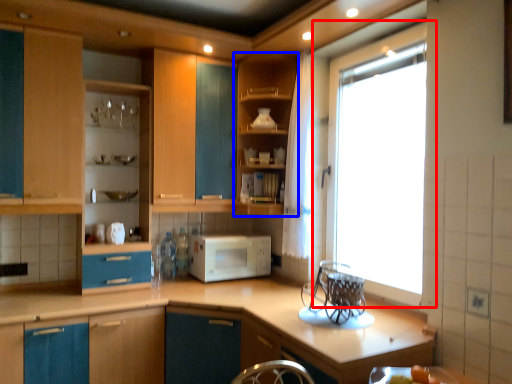
Question: Which point is closer to the camera, window (highlighted by a red box) or cabinetry (highlighted by a blue box)?

Choices:
 (A) window
 (B) cabinetry

Answer: (A)